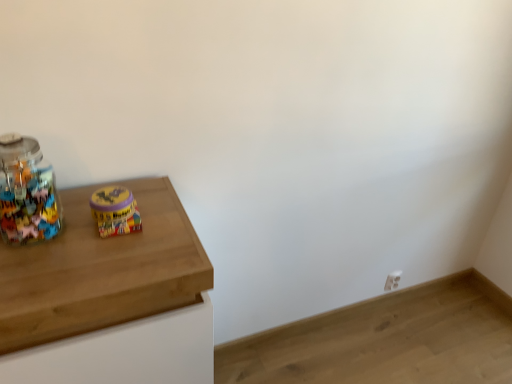
In order to click on wooden table at left in this screenshot , I will do `click(101, 270)`.

In order to face wooden table at left, should I rotate leftwards or rightwards?

Rotate your view left by about 20.744°.

The width and height of the screenshot is (512, 384). Describe the element at coordinates (101, 270) in the screenshot. I see `wooden table at left` at that location.

I want to click on wooden table at left, so click(x=101, y=270).